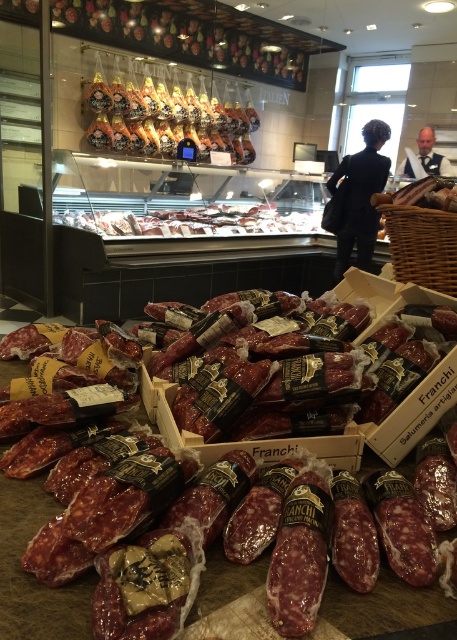
Is shiny brown ham at upper center further to the viewer compared to matte brown meat at center?

Yes, shiny brown ham at upper center is behind matte brown meat at center.

Between shiny brown ham at upper center and matte brown meat at center, which one appears on the right side from the viewer's perspective?

From the viewer's perspective, matte brown meat at center appears more on the right side.

Measure the distance between point (97, 99) and camera.

Point (97, 99) and camera are 16.03 feet apart from each other.

Locate an element on the screen. The image size is (457, 640). shiny brown ham at upper center is located at coordinates tap(166, 120).